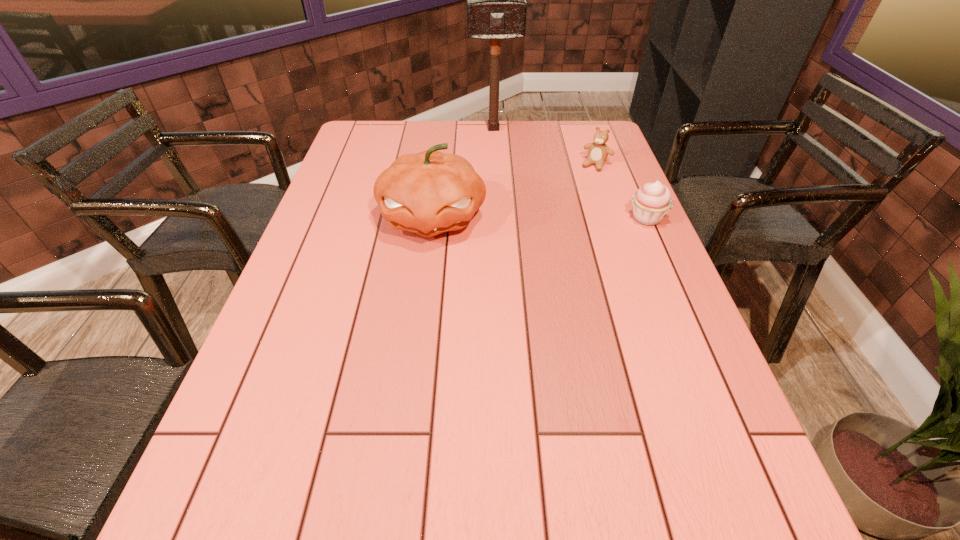
You are a GUI agent. You are given a task and a screenshot of the screen. Output one action in this format:
    pyautogui.click(x=<x>, y=<y>)
    Task: Click on the second tallest object
    
    Given the screenshot: What is the action you would take?
    pyautogui.click(x=427, y=193)

Where is `cupcake`? The height and width of the screenshot is (540, 960). cupcake is located at coordinates (652, 202).

Image resolution: width=960 pixels, height=540 pixels. Find the location of `mallet`. mallet is located at coordinates (496, 0).

Where is `the tallest object`? The height and width of the screenshot is (540, 960). the tallest object is located at coordinates (496, 0).

At what (x,y) coordinates should I click in order to perform the action: click on the third nearest object. Please return your answer as a coordinate pair (x, y). The width and height of the screenshot is (960, 540). Looking at the image, I should click on (598, 152).

You are a GUI agent. You are given a task and a screenshot of the screen. Output one action in this format:
    pyautogui.click(x=<x>, y=<y>)
    Task: Click on the free space located 0.190m on the front face of the pumpkin
    
    Given the screenshot: What is the action you would take?
    pyautogui.click(x=420, y=309)

Where is `vacant area located on the front of the cupcake`? vacant area located on the front of the cupcake is located at coordinates point(689,315).

What are the coordinates of `free space located on the head of the tallest object` in the screenshot? It's located at (x=502, y=175).

You are a GUI agent. You are given a task and a screenshot of the screen. Output one action in this format:
    pyautogui.click(x=<x>, y=<y>)
    Task: Click on the vacant region located on the head of the tallest object
    Image resolution: width=960 pixels, height=540 pixels.
    Given the screenshot: What is the action you would take?
    pyautogui.click(x=502, y=179)

Identify the location of vacant space situated 0.080m on the head of the tallest object. (497, 147).